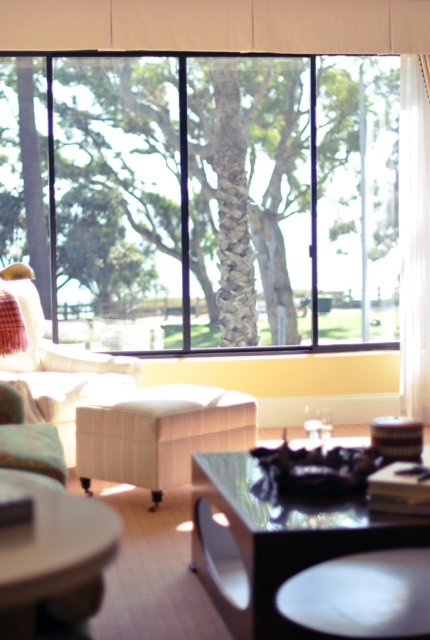
Consider the image. Does transparent glass coffee table at center have a greater width compared to plaid fabric armchair at left?

No, transparent glass coffee table at center is not wider than plaid fabric armchair at left.

Between point (196, 515) and point (3, 285), which one is positioned behind?

The point (3, 285) is more distant.

At what (x,y) coordinates should I click in order to perform the action: click on transparent glass coffee table at center. Please return your answer as a coordinate pair (x, y). Looking at the image, I should click on (276, 541).

Can you confirm if clear glass window at center is positioned to the left of white fabric curtain at upper center?

Correct, you'll find clear glass window at center to the left of white fabric curtain at upper center.

Identify the location of clear glass window at center. (205, 198).

Is wooden round table at lower left to the right of white sheer curtain at right from the viewer's perspective?

In fact, wooden round table at lower left is to the left of white sheer curtain at right.

Between wooden round table at lower left and white sheer curtain at right, which one is positioned higher?

white sheer curtain at right is above.

Which is behind, point (71, 628) or point (415, 96)?

The point (415, 96) is behind.

The width and height of the screenshot is (430, 640). What are the coordinates of `wooden round table at lower left` in the screenshot? It's located at (49, 556).